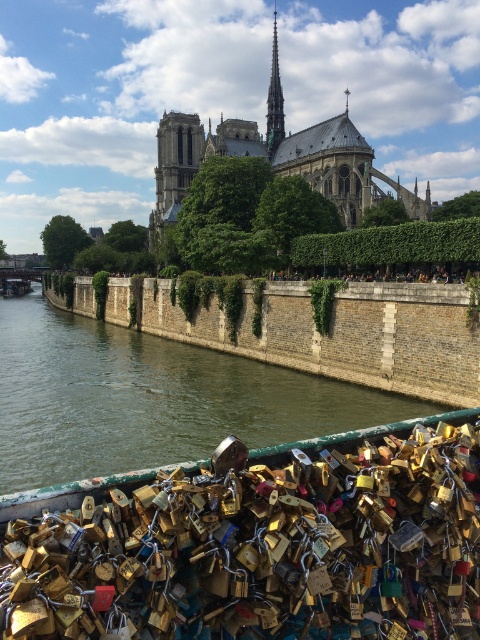
Which is more to the right, brown stone wall at lower center or smooth gray spire at upper center?

A: smooth gray spire at upper center

Measure the distance from brown stone wall at lower center to smooth gray spire at upper center.

brown stone wall at lower center is 86.79 meters from smooth gray spire at upper center.

Who is more distant from viewer, (118, 316) or (277, 83)?

Point (277, 83)

Where is `brown stone wall at lower center`? brown stone wall at lower center is located at coordinates (332, 332).

Who is positioned more to the right, gold metallic padlocks at center or smooth gray spire at upper center?

From the viewer's perspective, gold metallic padlocks at center appears more on the right side.

What do you see at coordinates (400, 273) in the screenshot? I see `gold metallic padlocks at center` at bounding box center [400, 273].

Find the location of a particular element. The width and height of the screenshot is (480, 640). gold metallic padlocks at center is located at coordinates (400, 273).

Is stone gothic cathedral at center bigger than smooth gray spire at upper center?

Yes.

Locate an element on the screen. stone gothic cathedral at center is located at coordinates (343, 170).

Is point (380, 195) positioned behind point (269, 157)?

That is False.

This screenshot has height=640, width=480. What are the coordinates of `stone gothic cathedral at center` in the screenshot? It's located at (343, 170).